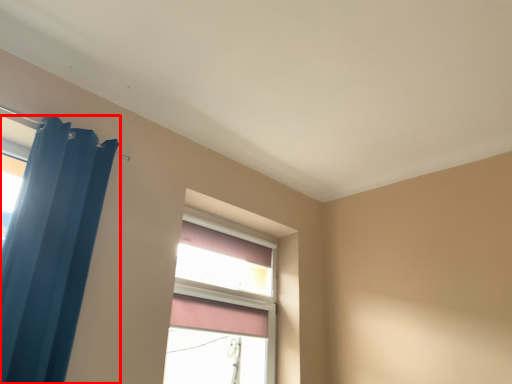
Question: From the image's perspective, what is the correct spatial positioning of curtain (annotated by the red box) in reference to window?

Choices:
 (A) above
 (B) below

Answer: (A)